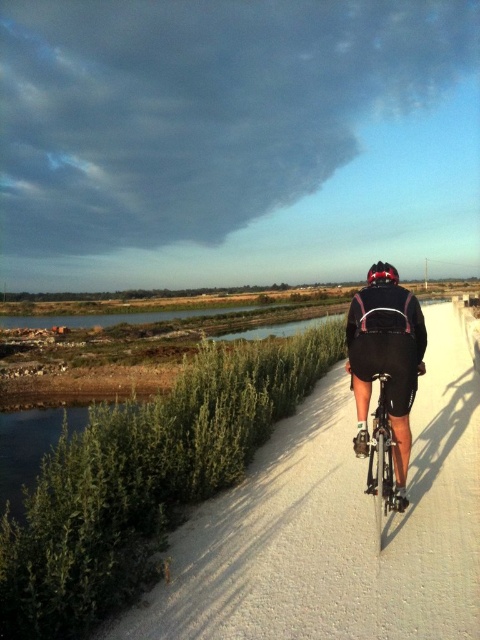
You are a photographer trying to capture the cyclist in the image. Since you want to focus on the cyclist, you need to adjust your camera settings to ensure that the black matte cycling suit at center and the matte black helmet at center are in sharp focus. Given their sizes, which object should you prioritize focusing on to ensure it appears clearer in the photo?

The black matte cycling suit at center has a smaller width than the matte black helmet at center, so you should prioritize focusing on the matte black helmet at center to ensure it appears clearer in the photo.

You are a cyclist planning to ride along the white textured path at center. You need to position your bike so that it stays on the path while avoiding the black matte cycling suit at center. Which direction should you steer your bike?

You should steer your bike to the right because the white textured path at center is to the right of the black matte cycling suit at center, so moving right will keep you on the path and away from the suit.